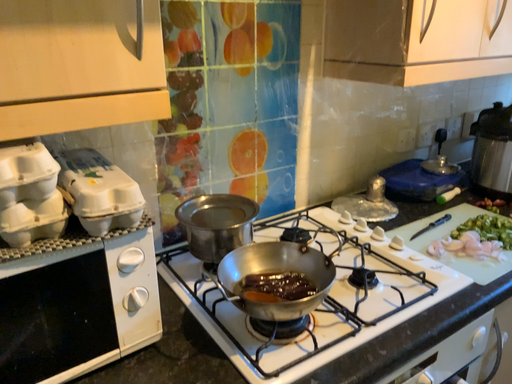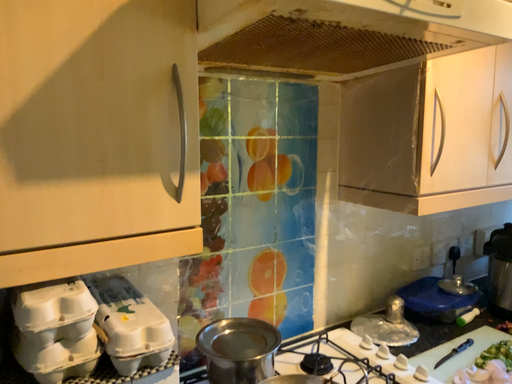
Question: Which way did the camera rotate in the video?

Choices:
 (A) rotated upward
 (B) rotated downward

Answer: (A)